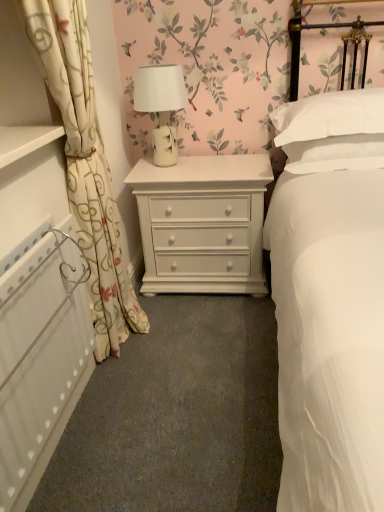
This screenshot has height=512, width=384. Describe the element at coordinates (330, 300) in the screenshot. I see `white smooth bed at center` at that location.

What is the approximate height of white smooth bed at center?

It is 4.30 feet.

This screenshot has width=384, height=512. I want to click on white ceramic lamp at center, so click(x=161, y=106).

This screenshot has height=512, width=384. I want to click on white floral fabric curtain at left, so click(x=86, y=166).

Describe the element at coordinates (40, 360) in the screenshot. This screenshot has height=512, width=384. I see `white textured radiator at left` at that location.

Find the location of a particular element. The height and width of the screenshot is (512, 384). white smooth bed at center is located at coordinates (330, 300).

Could you tell me if white textured radiator at left is turned towards white ceramic lamp at center?

No, white textured radiator at left is not oriented towards white ceramic lamp at center.

Image resolution: width=384 pixels, height=512 pixels. What are the coordinates of `radiator in front of the white ceramic lamp at center` in the screenshot? It's located at (40, 360).

What's the angular difference between white textured radiator at left and white ceramic lamp at center's facing directions?

The angular difference between white textured radiator at left and white ceramic lamp at center is 89.7 degrees.

Considering the sizes of objects white textured radiator at left and white ceramic lamp at center in the image provided, who is bigger, white textured radiator at left or white ceramic lamp at center?

Bigger between the two is white textured radiator at left.

Between point (372, 97) and point (168, 130), which one is positioned behind?

The point (168, 130) is farther from the camera.

Are white soft pillow at upper right and white ceramic lamp at center far apart?

No, white soft pillow at upper right is not far away from white ceramic lamp at center.

Locate an element on the screen. pillow on the right of the white ceramic lamp at center is located at coordinates (330, 116).

Can you confirm if white soft pillow at upper right is positioned to the left of white ceramic lamp at center?

No, white soft pillow at upper right is not to the left of white ceramic lamp at center.

Are white ceramic lamp at center and white textured radiator at left making contact?

white ceramic lamp at center is not next to white textured radiator at left, and they're not touching.

Considering their positions, is white ceramic lamp at center located in front of or behind white textured radiator at left?

Visually, white ceramic lamp at center is located behind white textured radiator at left.

From the image's perspective, relative to white textured radiator at left, is white ceramic lamp at center above or below?

Clearly, from the image's perspective, white ceramic lamp at center is above white textured radiator at left.

Where is `radiator in front of the white ceramic lamp at center`? radiator in front of the white ceramic lamp at center is located at coordinates (40, 360).

From the image's perspective, does white smooth bed at center appear lower than white painted wood chest of drawers at center?

Correct, white smooth bed at center appears lower than white painted wood chest of drawers at center in the image.

Is white smooth bed at center looking in the opposite direction of white painted wood chest of drawers at center?

No, white smooth bed at center is not facing away from white painted wood chest of drawers at center.

Is point (344, 261) farther from viewer compared to point (143, 278)?

No.

Is white painted wood chest of drawers at center facing towards white smooth bed at center?

Yes, white painted wood chest of drawers at center is facing white smooth bed at center.

How different are the orientations of white painted wood chest of drawers at center and white smooth bed at center in degrees?

There is a 1.37-degree angle between the facing directions of white painted wood chest of drawers at center and white smooth bed at center.

In the image, is white painted wood chest of drawers at center on the left side or the right side of white smooth bed at center?

Clearly, white painted wood chest of drawers at center is on the left of white smooth bed at center in the image.

Is white painted wood chest of drawers at center smaller than white smooth bed at center?

Yes, white painted wood chest of drawers at center is smaller than white smooth bed at center.

Is white soft pillow at upper right touching white floral fabric curtain at left?

No, white soft pillow at upper right is not touching white floral fabric curtain at left.

Is white soft pillow at upper right taller than white floral fabric curtain at left?

No.

Is white soft pillow at upper right inside or outside of white floral fabric curtain at left?

white soft pillow at upper right exists outside the volume of white floral fabric curtain at left.

Who is more distant, white soft pillow at upper right or white floral fabric curtain at left?

white soft pillow at upper right is further away from the camera.

Between white smooth bed at center and white floral fabric curtain at left, which one has smaller width?

With smaller width is white floral fabric curtain at left.

Can you tell me how much white smooth bed at center and white floral fabric curtain at left differ in facing direction?

They differ by 90.5 degrees in their facing directions.

At what (x,y) coordinates should I click in order to perform the action: click on bed lying on the right of white floral fabric curtain at left. Please return your answer as a coordinate pair (x, y). Looking at the image, I should click on (330, 300).

Who is bigger, white smooth bed at center or white floral fabric curtain at left?

With larger size is white smooth bed at center.

Locate an element on the screen. The width and height of the screenshot is (384, 512). radiator that appears below the white ceramic lamp at center (from the image's perspective) is located at coordinates (40, 360).

In the image, there is a white ceramic lamp at center. At what (x,y) coordinates should I click in order to perform the action: click on pillow below it (from a real-world perspective). Please return your answer as a coordinate pair (x, y). Image resolution: width=384 pixels, height=512 pixels. Looking at the image, I should click on (330, 116).

Which object lies further to the anchor point white painted wood chest of drawers at center, white textured radiator at left or white ceramic lamp at center?

white textured radiator at left lies further to white painted wood chest of drawers at center than the other object.

Which object lies nearer to the anchor point white painted wood chest of drawers at center, white soft pillow at upper right or white floral fabric curtain at left?

The object closer to white painted wood chest of drawers at center is white floral fabric curtain at left.

Which object lies nearer to the anchor point white floral fabric curtain at left, white soft pillow at upper right or white smooth bed at center?

white smooth bed at center is positioned closer to the anchor white floral fabric curtain at left.

Looking at the image, which one is located further to white ceramic lamp at center, white textured radiator at left or white smooth bed at center?

Based on the image, white textured radiator at left appears to be further to white ceramic lamp at center.

Considering their positions, is white smooth bed at center positioned closer to white textured radiator at left than white floral fabric curtain at left?

Based on the image, white floral fabric curtain at left appears to be nearer to white textured radiator at left.

Estimate the real-world distances between objects in this image. Which object is further from white ceramic lamp at center, white soft pillow at upper right or white textured radiator at left?

The object further to white ceramic lamp at center is white textured radiator at left.

Based on their spatial positions, is white textured radiator at left or white soft pillow at upper right closer to white ceramic lamp at center?

Among the two, white soft pillow at upper right is located nearer to white ceramic lamp at center.

When comparing their distances from white smooth bed at center, does white floral fabric curtain at left or white painted wood chest of drawers at center seem closer?

Among the two, white painted wood chest of drawers at center is located nearer to white smooth bed at center.

At what (x,y) coordinates should I click in order to perform the action: click on radiator positioned between white smooth bed at center and white floral fabric curtain at left from near to far. Please return your answer as a coordinate pair (x, y). The width and height of the screenshot is (384, 512). Looking at the image, I should click on (40, 360).

You are a GUI agent. You are given a task and a screenshot of the screen. Output one action in this format:
    pyautogui.click(x=<x>, y=<y>)
    Task: Click on the curtain positioned between white smooth bed at center and white ceramic lamp at center from near to far
    The height and width of the screenshot is (512, 384).
    Given the screenshot: What is the action you would take?
    pyautogui.click(x=86, y=166)

The image size is (384, 512). Find the location of `curtain between white smooth bed at center and white soft pillow at upper right in the front-back direction`. curtain between white smooth bed at center and white soft pillow at upper right in the front-back direction is located at coordinates (86, 166).

Image resolution: width=384 pixels, height=512 pixels. What are the coordinates of `curtain positioned between white smooth bed at center and white painted wood chest of drawers at center from near to far` in the screenshot? It's located at (86, 166).